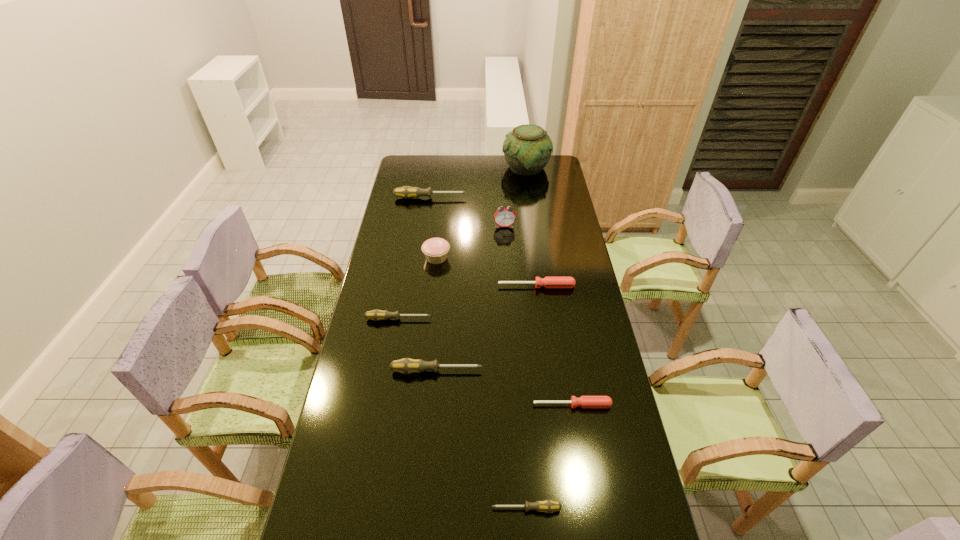
Identify which red screwdriver is the nearest to the third nearest screwdriver. Please provide its 2D coordinates. Your answer should be formatted as a tuple, i.e. [(x, y)], where the tuple contains the x and y coordinates of a point satisfying the conditions above.

[(584, 401)]